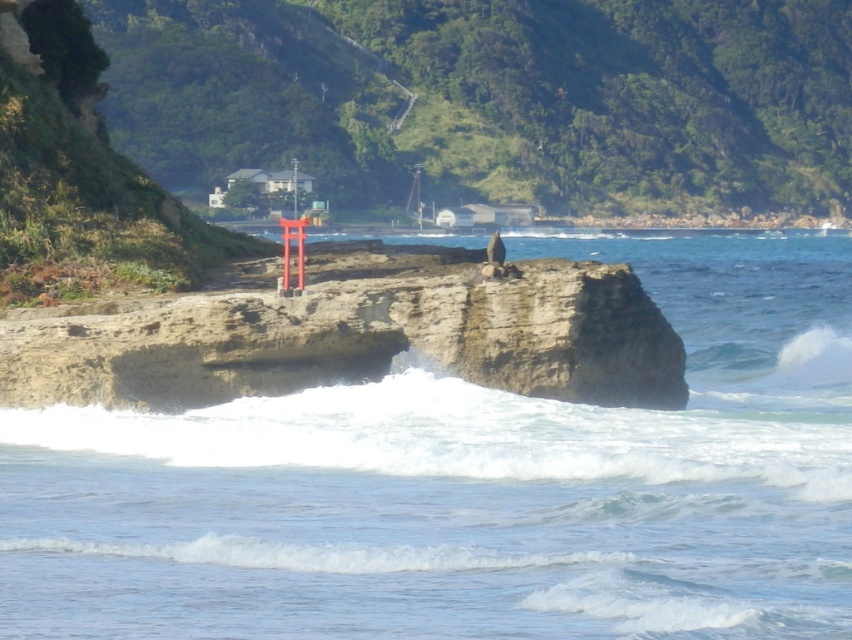
Which is more to the left, clear blue water at center or rusty stone cliff at center?

Positioned to the left is rusty stone cliff at center.

Is clear blue water at center to the left of rusty stone cliff at center from the viewer's perspective?

Incorrect, clear blue water at center is not on the left side of rusty stone cliff at center.

What do you see at coordinates (471, 486) in the screenshot? The width and height of the screenshot is (852, 640). I see `clear blue water at center` at bounding box center [471, 486].

This screenshot has width=852, height=640. Identify the location of clear blue water at center. (471, 486).